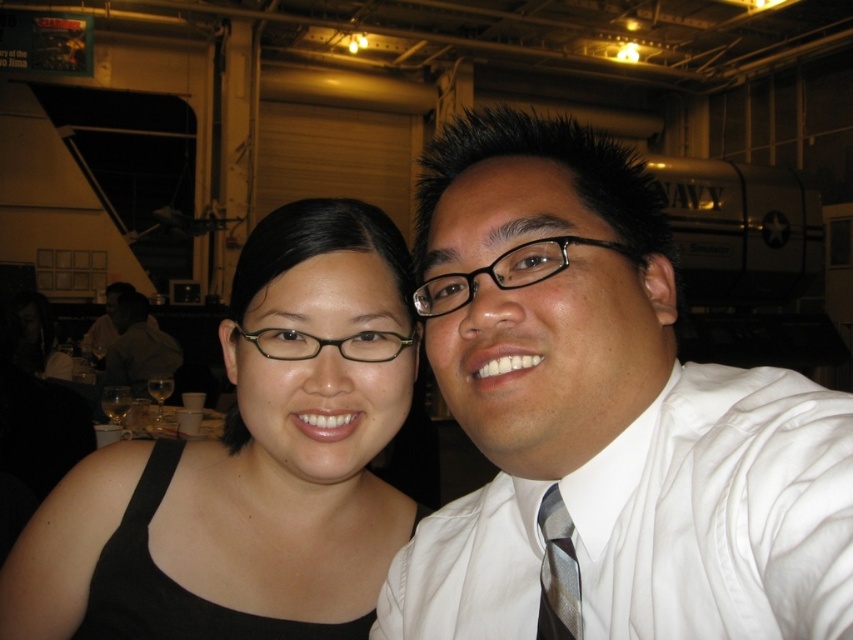
Between white satin shirt at center and silver striped tie at right, which one appears on the left side from the viewer's perspective?

silver striped tie at right

Where is `white satin shirt at center`? white satin shirt at center is located at coordinates (605, 416).

Who is more forward, (602, 515) or (312, 355)?

Point (602, 515) is in front.

Which is in front, point (432, 262) or point (254, 344)?

Point (432, 262) is in front.

The height and width of the screenshot is (640, 853). What are the coordinates of `white satin shirt at center` in the screenshot? It's located at (605, 416).

Which is above, black matte glasses at upper left or matte black glasses at left?

black matte glasses at upper left is above.

Does point (357, 428) lie in front of point (119, 355)?

Yes.

Locate an element on the screen. This screenshot has height=640, width=853. black matte glasses at upper left is located at coordinates (247, 467).